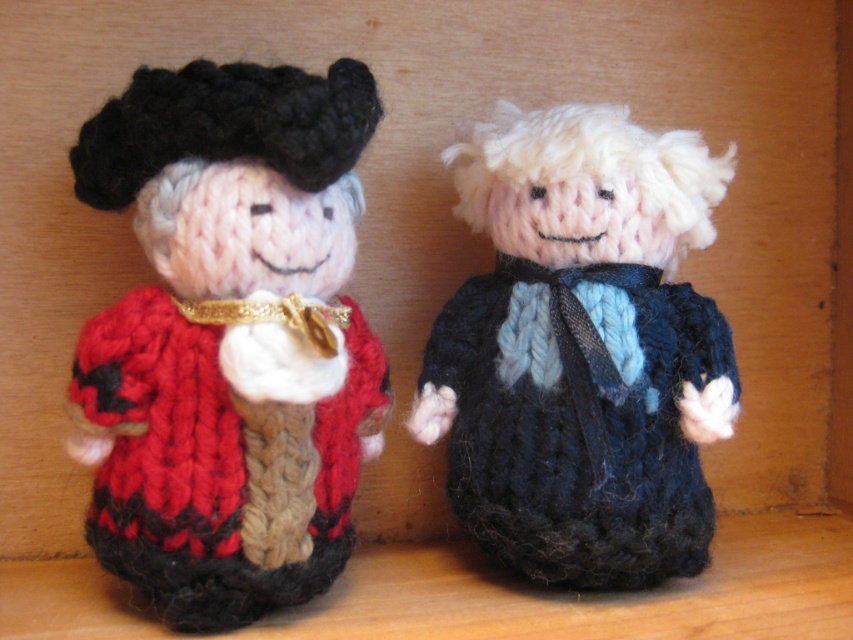
Consider the image. You are an artist trying to sketch the dolls accurately. You need to determine which of the two points, point (248, 125) or point (666, 481), is closer to you. Which one should you focus on first for proper perspective?

Point (248, 125) is closer to the viewer than point (666, 481), so you should focus on point (248, 125) first for proper perspective.

You are an art curator preparing an exhibition. You have a knitted woolen doll at center that needs to be displayed on a pedestal. The pedestal you have is 36 inches tall. Will the doll be visible over the edge of the pedestal?

The knitted woolen doll at center is 36.50 inches away from the viewer, which means it is slightly taller than the 36 inch pedestal. Therefore, the doll will be visible over the edge of the pedestal.

You are a collector of handmade dolls and you are looking at the image. You want to know if the knitted woolen doll at center is placed above or below the knitted blue sweater at center. Can you tell me?

The knitted woolen doll at center is located below the knitted blue sweater at center according to the description.